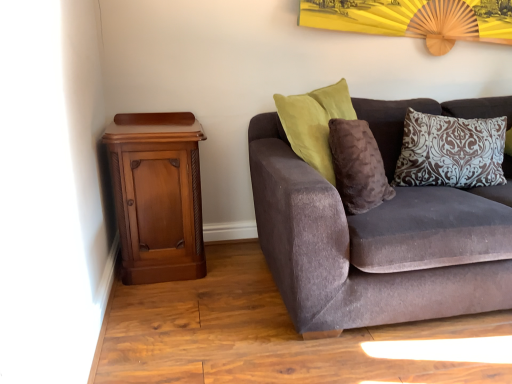
Where is `empty space that is to the right of polished wood nightstand at left`? empty space that is to the right of polished wood nightstand at left is located at coordinates (234, 273).